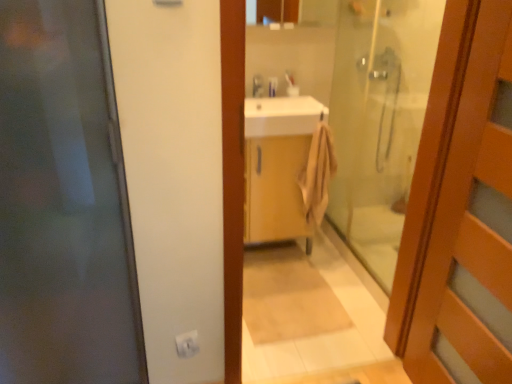
Question: Is transparent glass door at left, the 1th door when ordered from left to right, taller or shorter than wooden cabinet at center?

Choices:
 (A) short
 (B) tall

Answer: (B)

Question: From the image's perspective, is transparent glass door at left, the 1th door when ordered from left to right, located above or below wooden cabinet at center?

Choices:
 (A) above
 (B) below

Answer: (B)

Question: Which object is the farthest from the wooden door at right, which is the first door in right-to-left order?

Choices:
 (A) beige cotton towel at center
 (B) white glossy sink at center
 (C) transparent glass door at left, the second door in the right-to-left sequence
 (D) transparent glass shower door at center
 (E) white plastic toothbrush at center, the first toiletry in the left-to-right sequence

Answer: (E)

Question: Estimate the real-world distances between objects in this image. Which object is closer to the white plastic electric outlet at lower center?

Choices:
 (A) wooden door at right, which appears as the 2th door when viewed from the left
 (B) beige cotton towel at center
 (C) white plastic toothbrush at upper center, which is the 1th toiletry from right to left
 (D) white plastic toothbrush at center, marked as the second toiletry in a right-to-left arrangement
 (E) white glossy sink at center

Answer: (A)